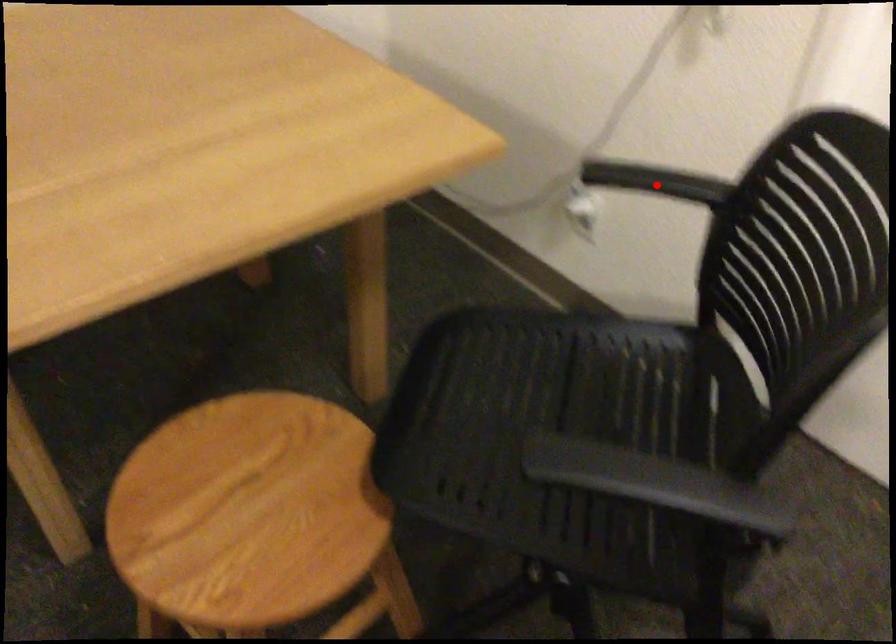
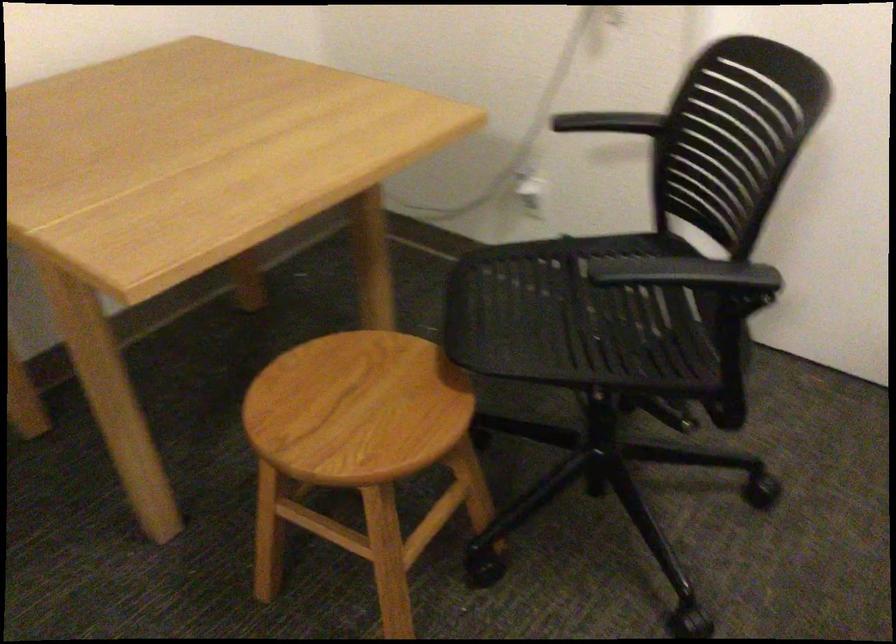
Where in the second image is the point corresponding to the highlighted location from the first image?

(607, 122)